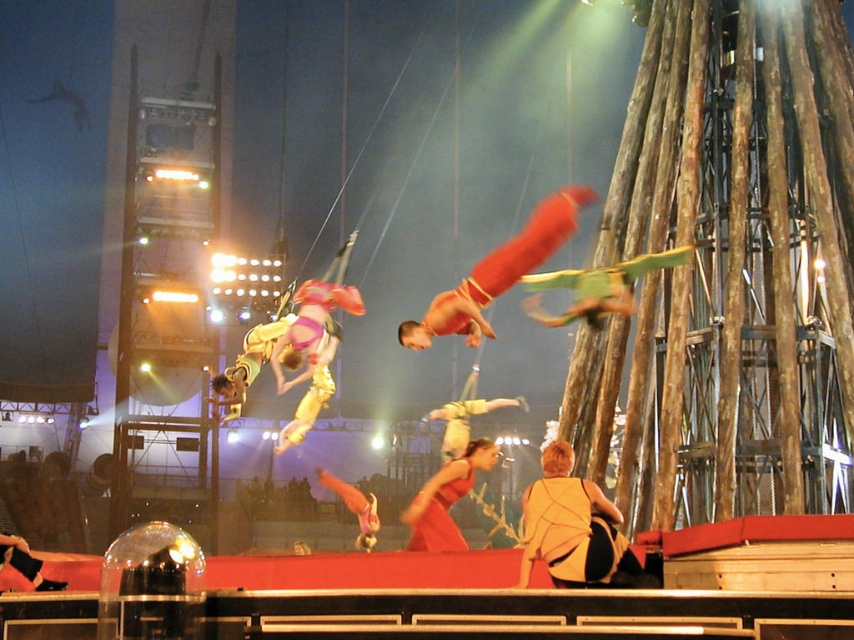
Is point (507, 276) farther from camera compared to point (425, 541)?

That is True.

In the scene shown: Does matte red pants at center have a larger size compared to shiny red fabric at center?

Indeed, matte red pants at center has a larger size compared to shiny red fabric at center.

Where is `matte red pants at center`? The width and height of the screenshot is (854, 640). matte red pants at center is located at coordinates (499, 272).

Can you confirm if shiny red fabric at center is smaller than yellow fabric acrobat at center?

Actually, shiny red fabric at center might be larger than yellow fabric acrobat at center.

Which of these two, shiny red fabric at center or yellow fabric acrobat at center, stands taller?

shiny red fabric at center is taller.

Is point (443, 532) farther from viewer compared to point (428, 419)?

No, (443, 532) is closer to viewer.

Locate an element on the screen. shiny red fabric at center is located at coordinates (446, 499).

Is yellow fabric at center below yellow fabric acrobat at center?

No.

Does point (534, 532) come behind point (460, 406)?

No, (534, 532) is in front of (460, 406).

Does point (609, 584) come behind point (492, 401)?

No, (609, 584) is closer to viewer.

Find the location of a particular element. yellow fabric at center is located at coordinates (571, 525).